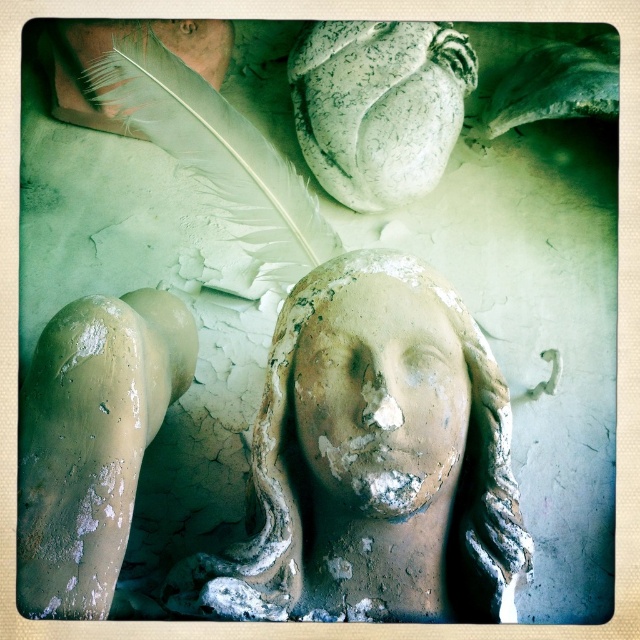
Looking at this image, does matte clay head at center have a smaller size compared to matte clay face at center?

Actually, matte clay head at center might be larger than matte clay face at center.

Can you confirm if matte clay head at center is bigger than matte clay face at center?

Yes.

Where is `matte clay head at center`? Image resolution: width=640 pixels, height=640 pixels. matte clay head at center is located at coordinates (372, 461).

Identify the location of matte clay head at center. Image resolution: width=640 pixels, height=640 pixels. (372, 461).